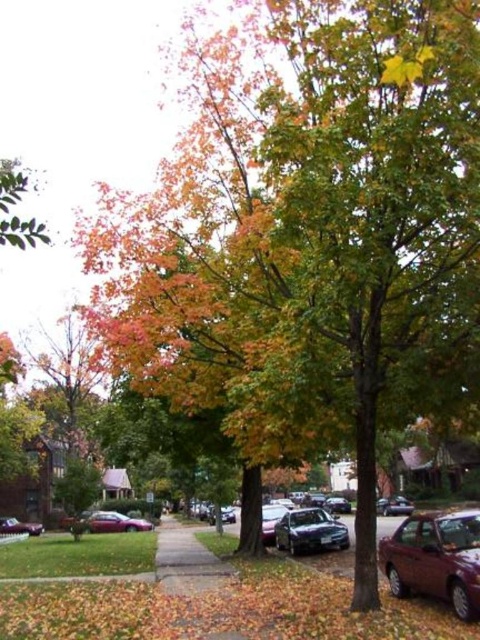
You are standing at the point with coordinates (310, 531) in the suburban street scene. What object is exactly at this point?

The satin black sedan at center is located at point (310, 531).

You are a delivery person who needs to unload a package between the satin black sedan at center and the metallic purple sedan at center. The package requires a minimum of 30 feet of space to safely place it. Can you fit the package between these two vehicles?

The satin black sedan at center is 37.72 feet from the metallic purple sedan at center, which is more than the required 30 feet. Therefore, the package can be safely placed between them.

You are a pedestrian walking on the gray concrete sidewalk at center and want to cross the street to reach a store on the other side. There is a shiny silver sedan at center blocking your path. Can you step onto the sidewalk to go around the car?

The gray concrete sidewalk at center is closer to the viewer than the shiny silver sedan at center, so you can step onto the gray concrete sidewalk at center to go around the shiny silver sedan at center.